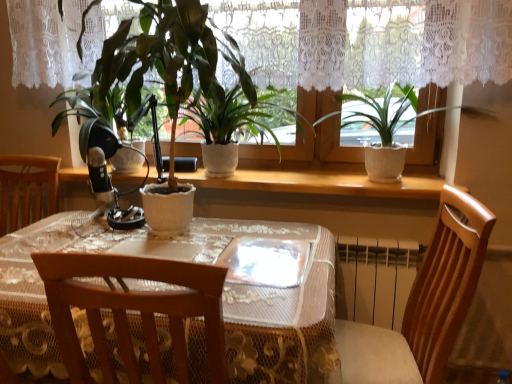
Question: Considering the relative sizes of white textured pot at upper right, the first houseplant in the right-to-left sequence, and wooden chair at lower right in the image provided, is white textured pot at upper right, the first houseplant in the right-to-left sequence, wider than wooden chair at lower right?

Choices:
 (A) yes
 (B) no

Answer: (B)

Question: Does white textured pot at upper right, which appears as the 2th houseplant when viewed from the left, turn towards wooden chair at lower right?

Choices:
 (A) yes
 (B) no

Answer: (B)

Question: From the image's perspective, is white textured pot at upper right, the first houseplant in the right-to-left sequence, on top of wooden chair at lower right?

Choices:
 (A) yes
 (B) no

Answer: (A)

Question: Is white textured pot at upper right, the first houseplant in the right-to-left sequence, not near wooden chair at lower right?

Choices:
 (A) yes
 (B) no

Answer: (B)

Question: Is white textured pot at upper right, which appears as the 2th houseplant when viewed from the left, positioned before wooden chair at lower right?

Choices:
 (A) yes
 (B) no

Answer: (B)

Question: From a real-world perspective, is white textured pot at upper right, the first houseplant in the right-to-left sequence, positioned under wooden chair at lower right based on gravity?

Choices:
 (A) yes
 (B) no

Answer: (B)

Question: From the image's perspective, is white ceramic plant pot at center under transparent plastic plate at center?

Choices:
 (A) yes
 (B) no

Answer: (B)

Question: Is white ceramic plant pot at center at the right side of transparent plastic plate at center?

Choices:
 (A) no
 (B) yes

Answer: (A)

Question: Can you confirm if white ceramic plant pot at center is thinner than transparent plastic plate at center?

Choices:
 (A) no
 (B) yes

Answer: (B)

Question: Is white ceramic plant pot at center not inside transparent plastic plate at center?

Choices:
 (A) yes
 (B) no

Answer: (A)

Question: Is white ceramic plant pot at center facing away from transparent plastic plate at center?

Choices:
 (A) no
 (B) yes

Answer: (A)

Question: Can you confirm if white ceramic plant pot at center is taller than transparent plastic plate at center?

Choices:
 (A) yes
 (B) no

Answer: (A)

Question: Is white textured pot at upper right, which appears as the 2th houseplant when viewed from the left, further to the viewer compared to white ceramic plant pot at center?

Choices:
 (A) no
 (B) yes

Answer: (A)